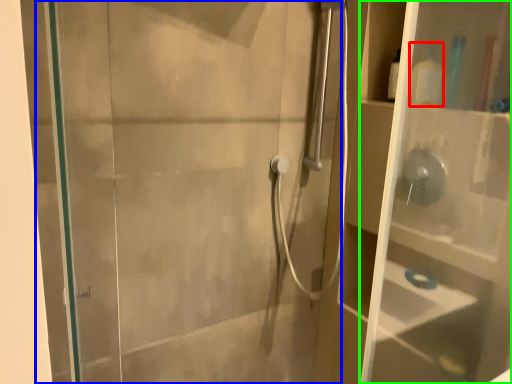
Question: Which is nearer to the toiletry (highlighted by a red box)? screen door (highlighted by a blue box) or glass box (highlighted by a green box).

Choices:
 (A) screen door
 (B) glass box

Answer: (B)